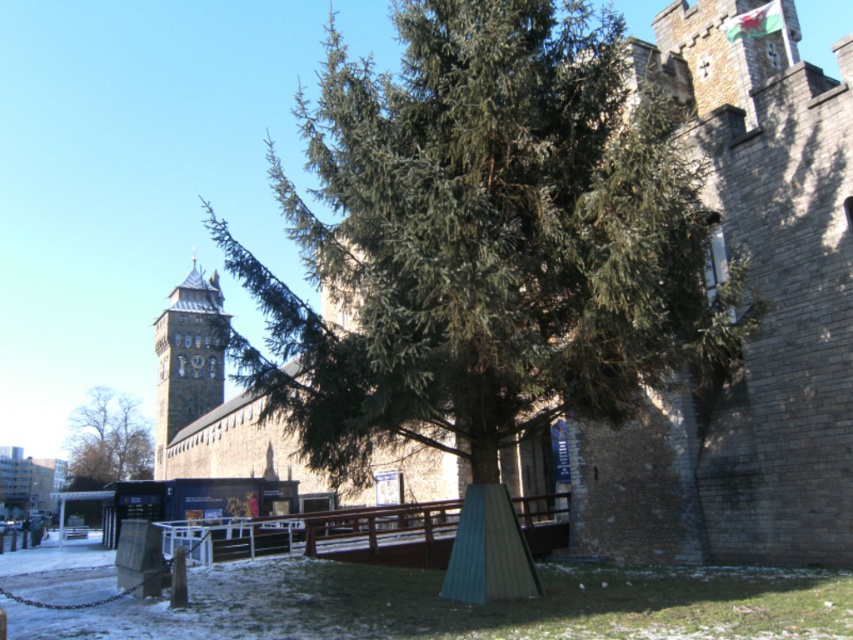
Between stone clock tower at center-left and brown leafy tree at left, which one appears on the left side from the viewer's perspective?

Positioned to the left is brown leafy tree at left.

Can you confirm if stone clock tower at center-left is smaller than brown leafy tree at left?

Incorrect, stone clock tower at center-left is not smaller in size than brown leafy tree at left.

Between point (160, 321) and point (125, 429), which one is positioned in front?

Point (160, 321) is more forward.

I want to click on stone clock tower at center-left, so click(x=189, y=356).